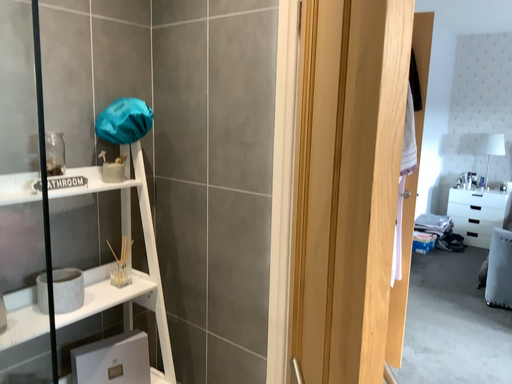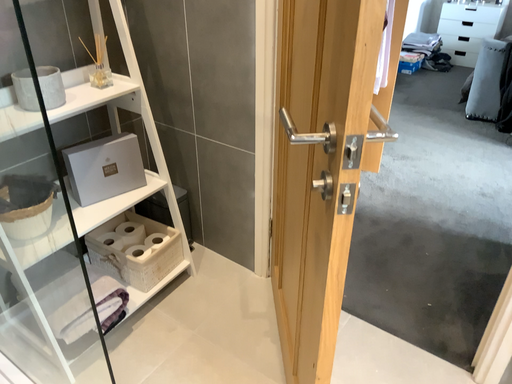
Question: Which way did the camera rotate in the video?

Choices:
 (A) rotated downward
 (B) rotated upward

Answer: (A)